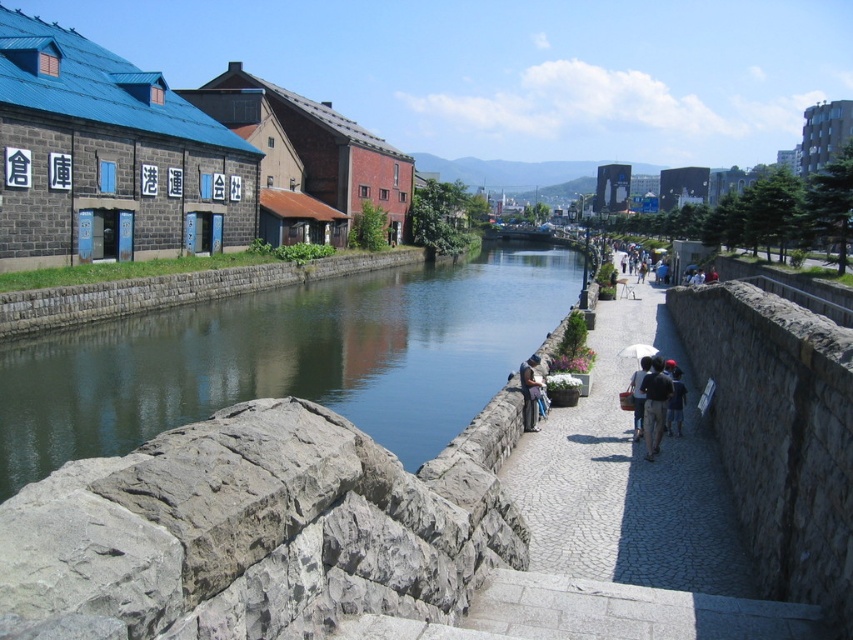
Question: Is black fabric backpack at lower center positioned behind matte black umbrella at center?

Choices:
 (A) no
 (B) yes

Answer: (A)

Question: Which object is farther from the camera taking this photo?

Choices:
 (A) smooth concrete river at center
 (B) black fabric backpack at lower center
 (C) dark blue shirt at lower center

Answer: (A)

Question: Can you confirm if matte blue shirt at center is positioned below matte black umbrella at center?

Choices:
 (A) no
 (B) yes

Answer: (A)

Question: Which object is farther from the camera taking this photo?

Choices:
 (A) matte blue shirt at center
 (B) matte black umbrella at center

Answer: (A)

Question: Among these objects, which one is nearest to the camera?

Choices:
 (A) black fabric backpack at lower center
 (B) smooth concrete river at center
 (C) cobblestone pathway at center
 (D) dark blue shirt at lower center

Answer: (C)

Question: Can you confirm if matte black umbrella at center is positioned above dark blue shirt at lower center?

Choices:
 (A) no
 (B) yes

Answer: (B)